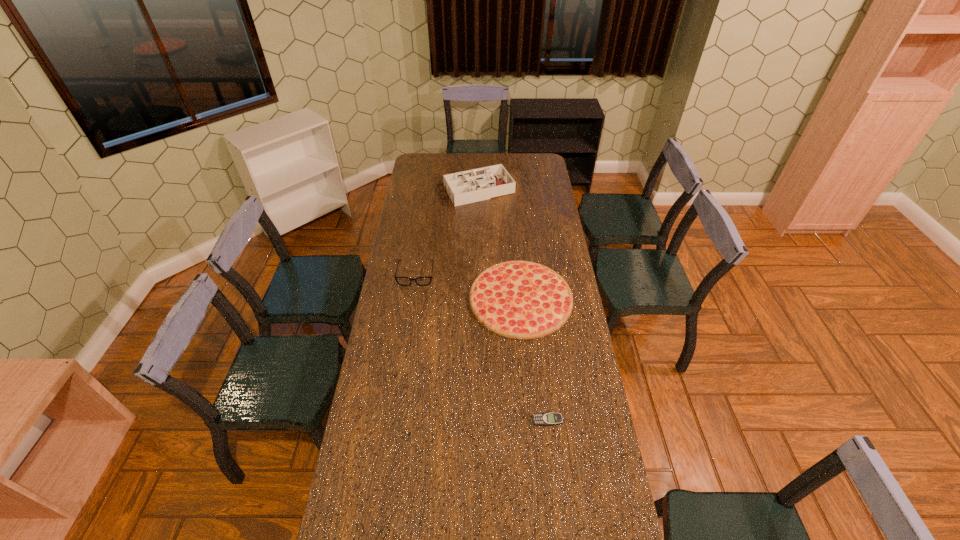
This screenshot has width=960, height=540. What are the coordinates of `vacant point located between the farthest object and the pizza` in the screenshot? It's located at [498, 245].

The image size is (960, 540). What are the coordinates of `free spot between the spectacles and the third tallest object` in the screenshot? It's located at [x=468, y=287].

At what (x,y) coordinates should I click in order to perform the action: click on free space between the pizza and the spectacles. Please return your answer as a coordinate pair (x, y). This screenshot has height=540, width=960. Looking at the image, I should click on (468, 287).

You are a GUI agent. You are given a task and a screenshot of the screen. Output one action in this format:
    pyautogui.click(x=<x>, y=<y>)
    Task: Click on the free point between the pizza and the second tallest object
    The width and height of the screenshot is (960, 540).
    Given the screenshot: What is the action you would take?
    pyautogui.click(x=468, y=287)

The width and height of the screenshot is (960, 540). In order to click on vacant region between the spectacles and the tallest object in this screenshot , I will do `click(446, 233)`.

At what (x,y) coordinates should I click in order to perform the action: click on vacant area that lies between the dollhouse and the spectacles. Please return your answer as a coordinate pair (x, y). Looking at the image, I should click on [446, 233].

You are a GUI agent. You are given a task and a screenshot of the screen. Output one action in this format:
    pyautogui.click(x=<x>, y=<y>)
    Task: Click on the object that stands as the second closest to the farthest object
    
    Given the screenshot: What is the action you would take?
    pyautogui.click(x=519, y=299)

This screenshot has width=960, height=540. In order to click on object that can be found as the second closest to the third shortest object in this screenshot , I will do `click(465, 187)`.

Find the location of a particular element. This screenshot has height=540, width=960. vacant space that satisfies the following two spatial constraints: 1. on the front-facing side of the spectacles; 2. on the right side of the shortest object is located at coordinates (395, 420).

You are a GUI agent. You are given a task and a screenshot of the screen. Output one action in this format:
    pyautogui.click(x=<x>, y=<y>)
    Task: Click on the free space that satisfies the following two spatial constraints: 1. on the front-facing side of the nearest object; 2. on the right side of the spectacles
    
    Given the screenshot: What is the action you would take?
    pyautogui.click(x=395, y=420)